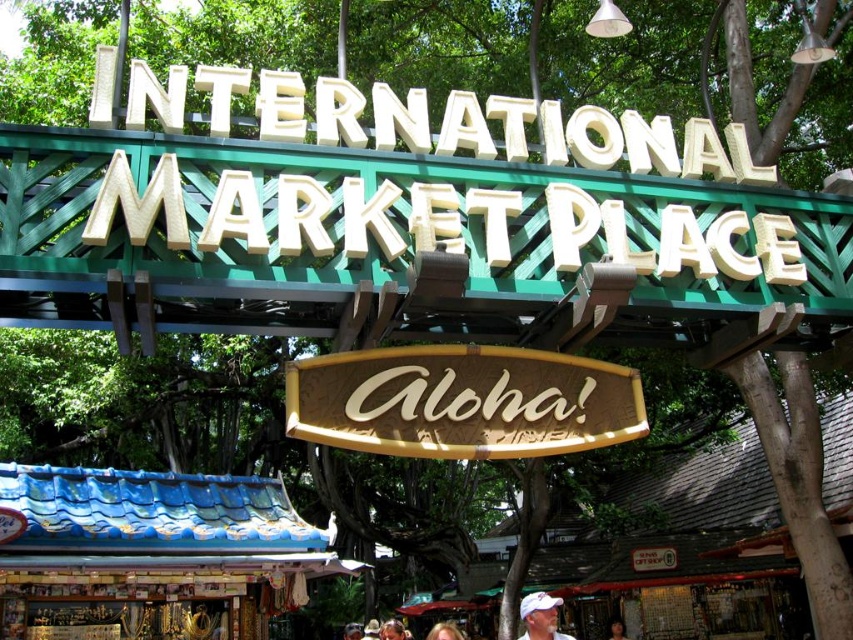
Which of these two, brown leather hat at center or smooth brown hair at center, stands shorter?

Standing shorter between the two is smooth brown hair at center.

Where is `brown leather hat at center`? Image resolution: width=853 pixels, height=640 pixels. brown leather hat at center is located at coordinates (392, 628).

Between point (550, 616) and point (618, 632), which one is positioned in front?

Point (550, 616)

Does point (526, 612) come behind point (625, 637)?

That is False.

Find the location of a particular element. white matte cap at lower center is located at coordinates (540, 616).

Does white matte cap at lower center appear under blonde hair at lower center?

Actually, white matte cap at lower center is above blonde hair at lower center.

Does white matte cap at lower center appear on the left side of blonde hair at lower center?

In fact, white matte cap at lower center is to the right of blonde hair at lower center.

Between point (537, 634) and point (438, 637), which one is positioned behind?

The point (438, 637) is more distant.

Locate an element on the screen. The width and height of the screenshot is (853, 640). white matte cap at lower center is located at coordinates (540, 616).